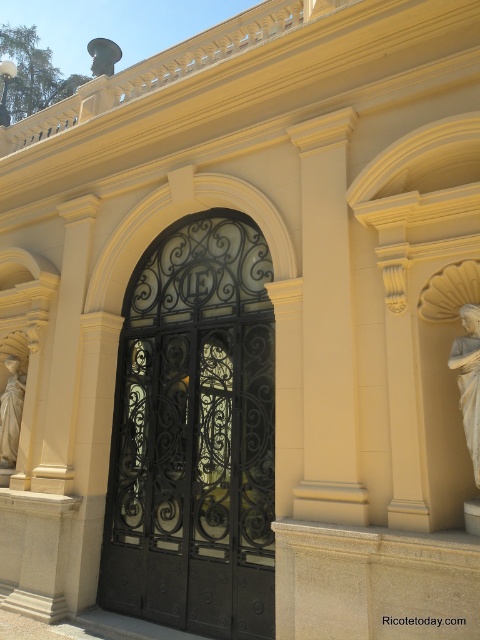
Between black wrought iron gate at center and white marble statue at left, which one appears on the left side from the viewer's perspective?

Positioned to the left is white marble statue at left.

Can you confirm if black wrought iron gate at center is smaller than white marble statue at left?

Incorrect, black wrought iron gate at center is not smaller in size than white marble statue at left.

Does point (210, 221) lie behind point (1, 429)?

No, it is in front of (1, 429).

Where is `black wrought iron gate at center`? The width and height of the screenshot is (480, 640). black wrought iron gate at center is located at coordinates (194, 435).

Is smooth cream stone column at left smaller than white marble statue at left?

Actually, smooth cream stone column at left might be larger than white marble statue at left.

Looking at this image, is smooth cream stone column at left above white marble statue at left?

Indeed, smooth cream stone column at left is positioned over white marble statue at left.

Find the location of a particular element. This screenshot has height=640, width=480. smooth cream stone column at left is located at coordinates pos(66,349).

At what (x,y) coordinates should I click in order to perform the action: click on smooth cream stone column at left. Please return your answer as a coordinate pair (x, y). Looking at the image, I should click on (66, 349).

This screenshot has width=480, height=640. Describe the element at coordinates (194, 435) in the screenshot. I see `black wrought iron gate at center` at that location.

Is point (170, 406) positioned before point (62, 342)?

Yes, point (170, 406) is closer to viewer.

Locate an element on the screen. This screenshot has height=640, width=480. black wrought iron gate at center is located at coordinates (194, 435).